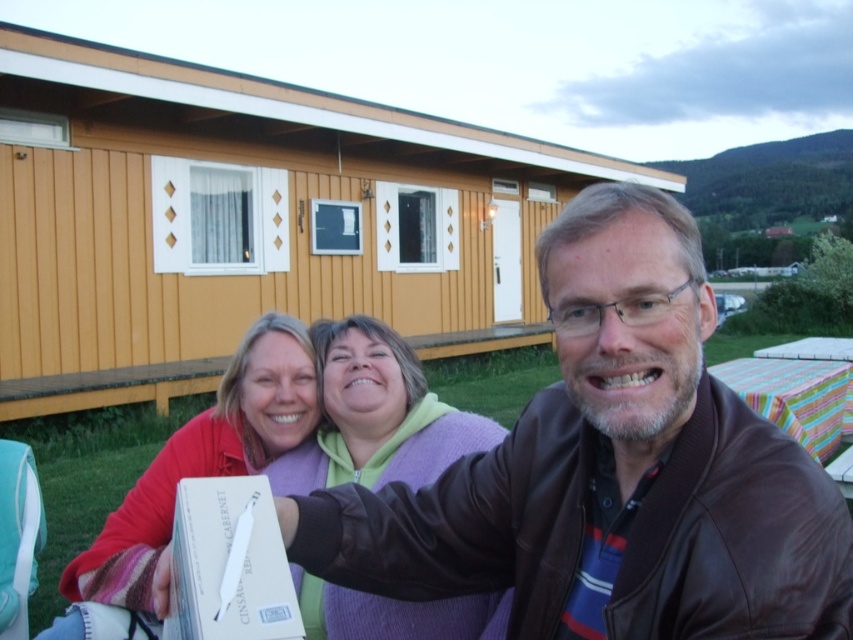
You are standing in front of the yellow wood cabin at center and want to greet the person wearing the purple fleece sweater at center. In which direction should you move to reach them?

The yellow wood cabin at center is to the right of the purple fleece sweater at center, so you should move to your left to reach the person wearing the purple fleece sweater at center.

You are standing in the scene and want to take a photo of the yellow wood cabin at center without the matte red sweater at center appearing in the frame. How should you adjust your position?

To exclude the matte red sweater at center from the photo, move your position so that the yellow wood cabin at center is no longer positioned over the matte red sweater at center.

You are standing in front of the yellow wood cabin at center and the matte red sweater at center. Which object is positioned to the left?

The matte red sweater at center is positioned to the left of the yellow wood cabin at center.